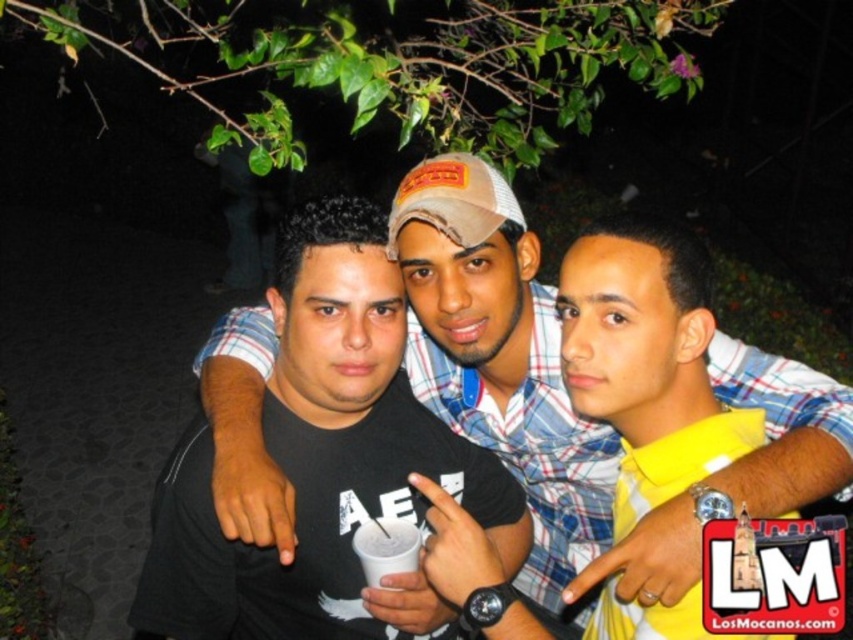
Identify the location of black matte shirt at center. This screenshot has width=853, height=640. (566, 396).

Where is `black matte shirt at center`? Image resolution: width=853 pixels, height=640 pixels. black matte shirt at center is located at coordinates (566, 396).

This screenshot has width=853, height=640. In order to click on black matte shirt at center in this screenshot , I will do `click(566, 396)`.

Can you confirm if black matte t-shirt at center is positioned above white matte cup at center?

Correct, black matte t-shirt at center is located above white matte cup at center.

Can you confirm if black matte t-shirt at center is bigger than white matte cup at center?

Yes.

Between point (403, 452) and point (379, 579), which one is positioned in front?

Point (379, 579) is in front.

The width and height of the screenshot is (853, 640). Find the location of `black matte t-shirt at center`. black matte t-shirt at center is located at coordinates (321, 461).

Is black matte shirt at center in front of black matte t-shirt at center?

No, it is not.

Does black matte shirt at center lie behind black matte t-shirt at center?

Yes, black matte shirt at center is behind black matte t-shirt at center.

You are a GUI agent. You are given a task and a screenshot of the screen. Output one action in this format:
    pyautogui.click(x=<x>, y=<y>)
    Task: Click on the black matte shirt at center
    The width and height of the screenshot is (853, 640).
    Given the screenshot: What is the action you would take?
    pyautogui.click(x=566, y=396)